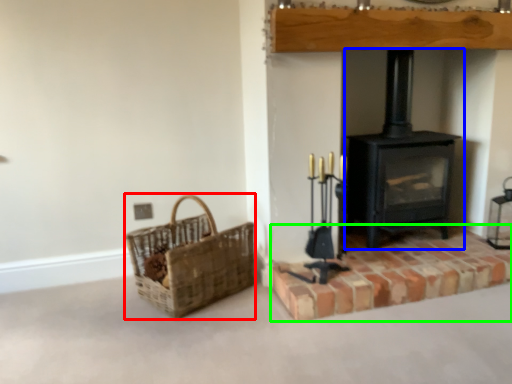
Question: Estimate the real-world distances between objects in this image. Which object is closer to basket (highlighted by a red box), wood burning stove (highlighted by a blue box) or brickwork (highlighted by a green box)?

Choices:
 (A) wood burning stove
 (B) brickwork

Answer: (B)